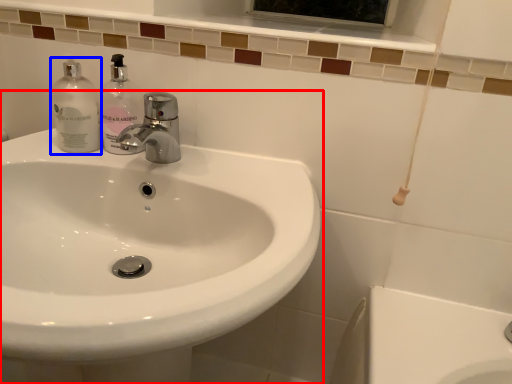
Question: Among these objects, which one is nearest to the camera, sink (highlighted by a red box) or cleaning product (highlighted by a blue box)?

Choices:
 (A) sink
 (B) cleaning product

Answer: (A)